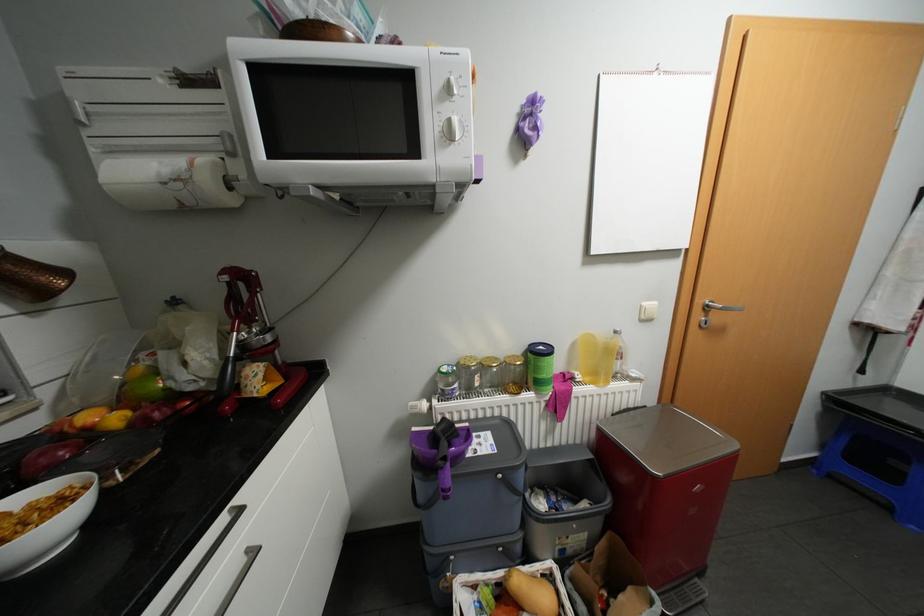
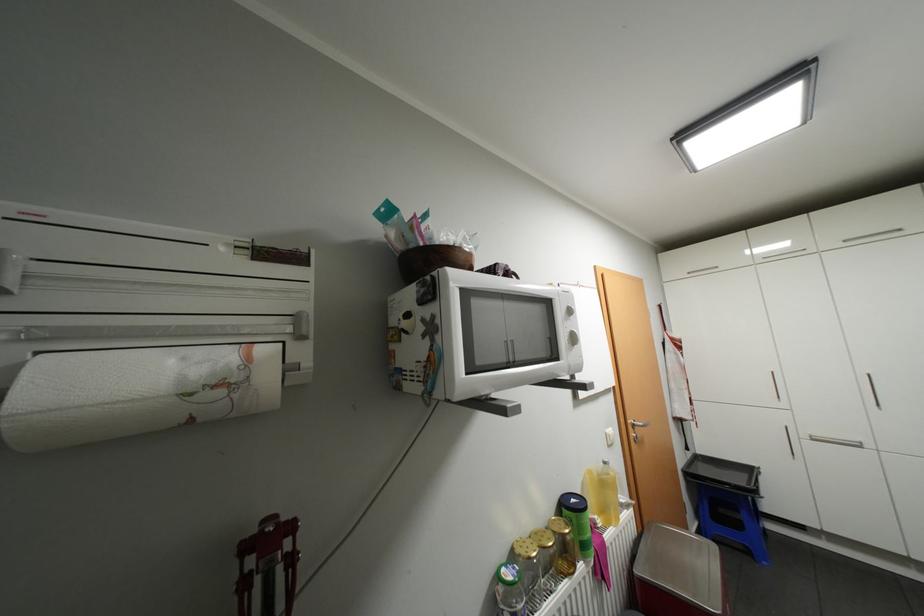
In the second image, find the point that corresponds to point 895,507 in the first image.

(756, 552)